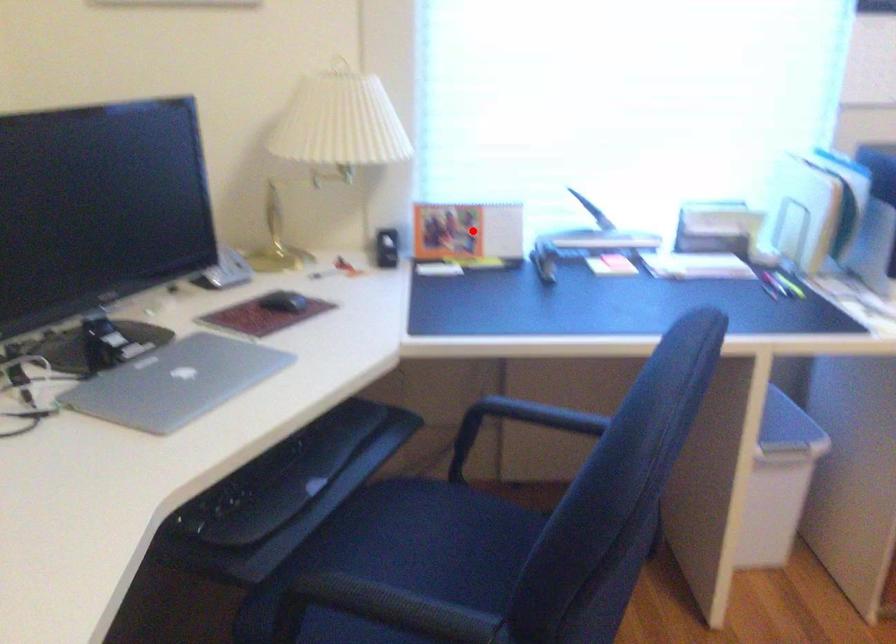
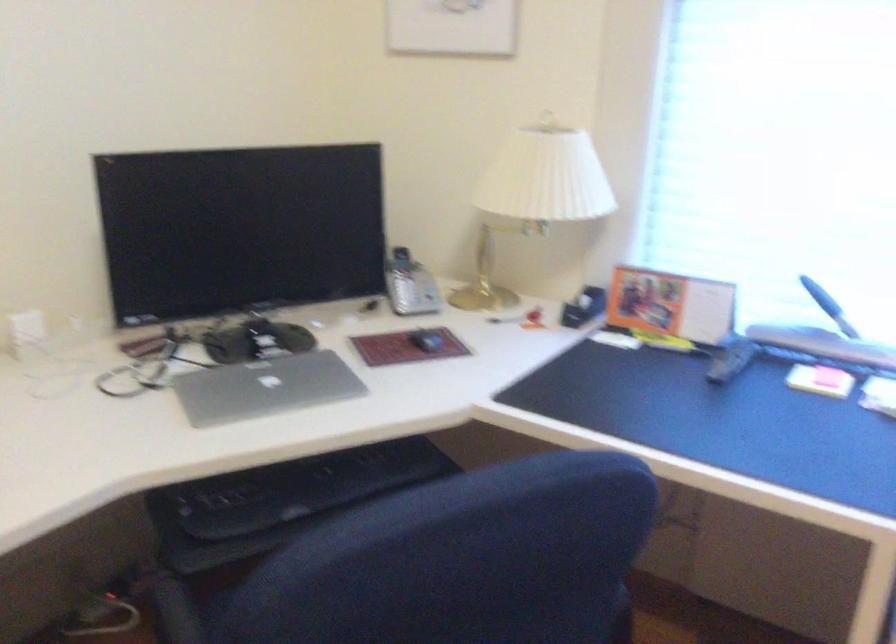
Question: A red point is marked in image1. In image2, is the corresponding 3D point closer to the camera or farther? Reply with the corresponding letter.

Choices:
 (A) The corresponding 3D point is closer.
 (B) The corresponding 3D point is farther.

Answer: (A)